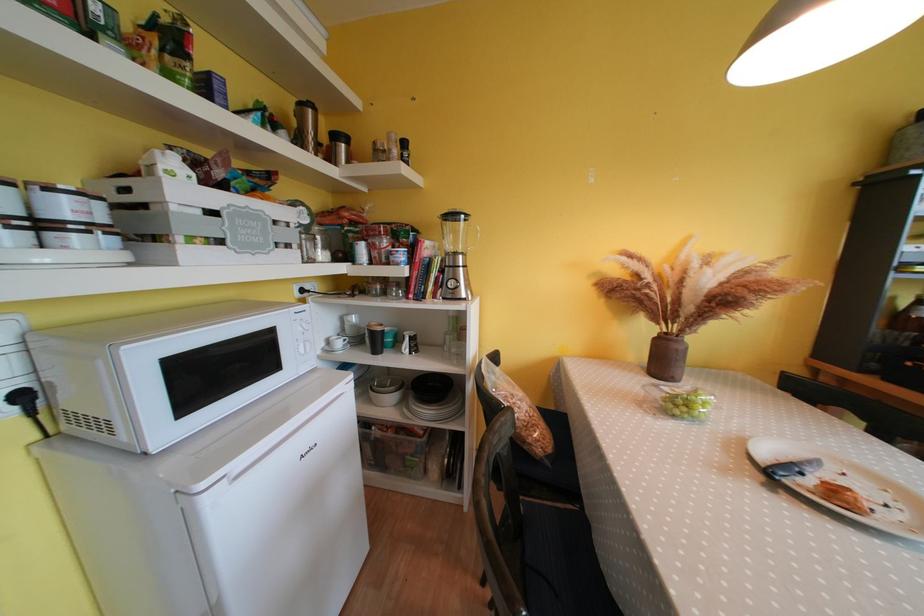
Find where to lift the black coffee cup. Please return your answer as a coordinate pair (x, y).

(374, 338)